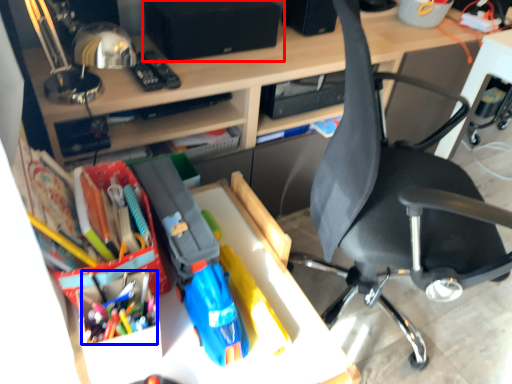
Question: Which of the following is the closest to the observer, speaker (highlighted by a red box) or stationery (highlighted by a blue box)?

Choices:
 (A) speaker
 (B) stationery

Answer: (B)